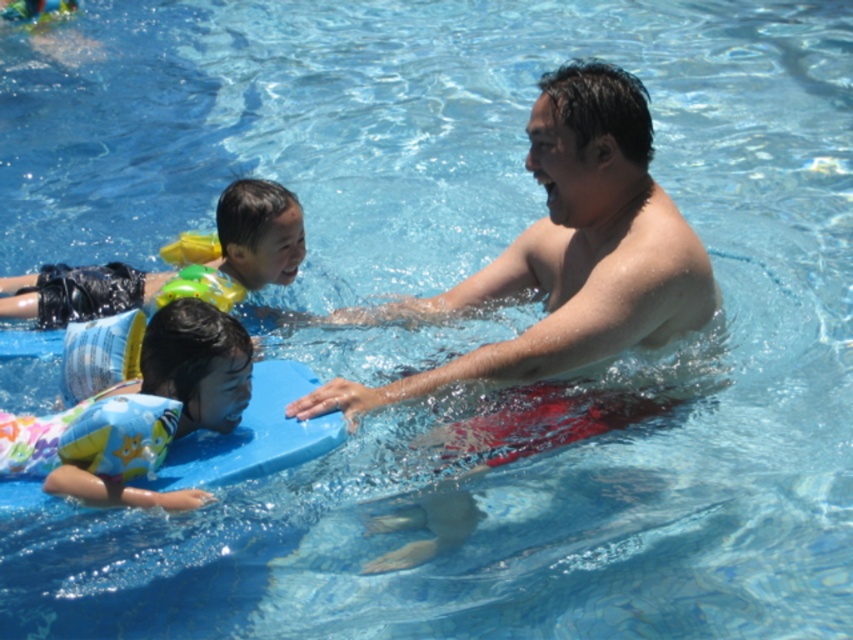
How much distance is there between shiny skin man at center and yellow inflatable float at upper center?

shiny skin man at center and yellow inflatable float at upper center are 1.31 meters apart from each other.

Does shiny skin man at center have a lesser width compared to yellow inflatable float at upper center?

In fact, shiny skin man at center might be wider than yellow inflatable float at upper center.

What do you see at coordinates (564, 253) in the screenshot? I see `shiny skin man at center` at bounding box center [564, 253].

The width and height of the screenshot is (853, 640). I want to click on shiny skin man at center, so point(564,253).

Measure the distance between multicolored inflatable float at lower left and yellow inflatable float at upper center.

multicolored inflatable float at lower left is 1.36 meters from yellow inflatable float at upper center.

Is the position of multicolored inflatable float at lower left more distant than that of yellow inflatable float at upper center?

No, it is not.

Image resolution: width=853 pixels, height=640 pixels. What are the coordinates of `multicolored inflatable float at lower left` in the screenshot? It's located at (140, 412).

Who is shorter, shiny skin man at center or multicolored inflatable float at lower left?

With less height is multicolored inflatable float at lower left.

Can you confirm if shiny skin man at center is wider than multicolored inflatable float at lower left?

Yes, shiny skin man at center is wider than multicolored inflatable float at lower left.

Who is more distant from viewer, [485,432] or [15,422]?

The point [485,432] is more distant.

This screenshot has height=640, width=853. What are the coordinates of `shiny skin man at center` in the screenshot? It's located at (564, 253).